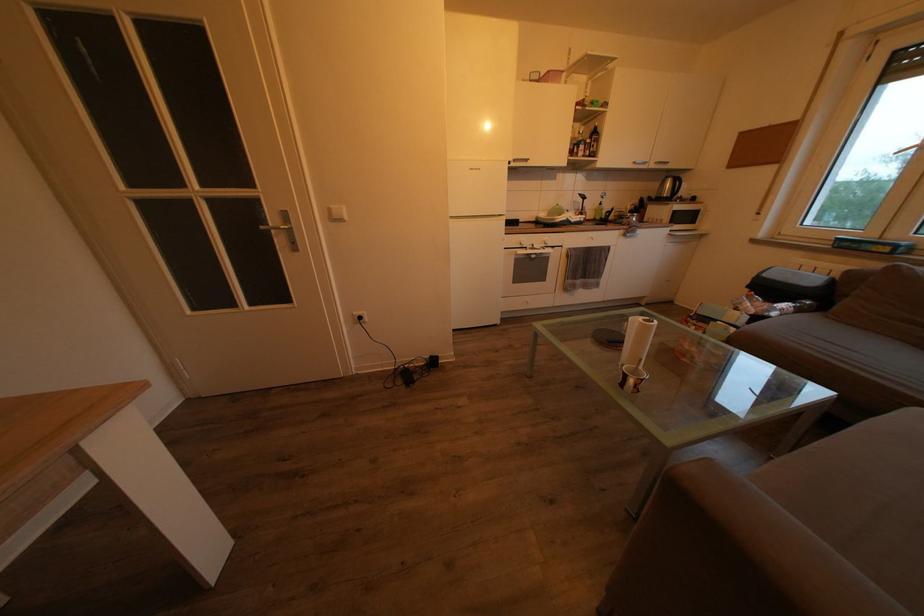
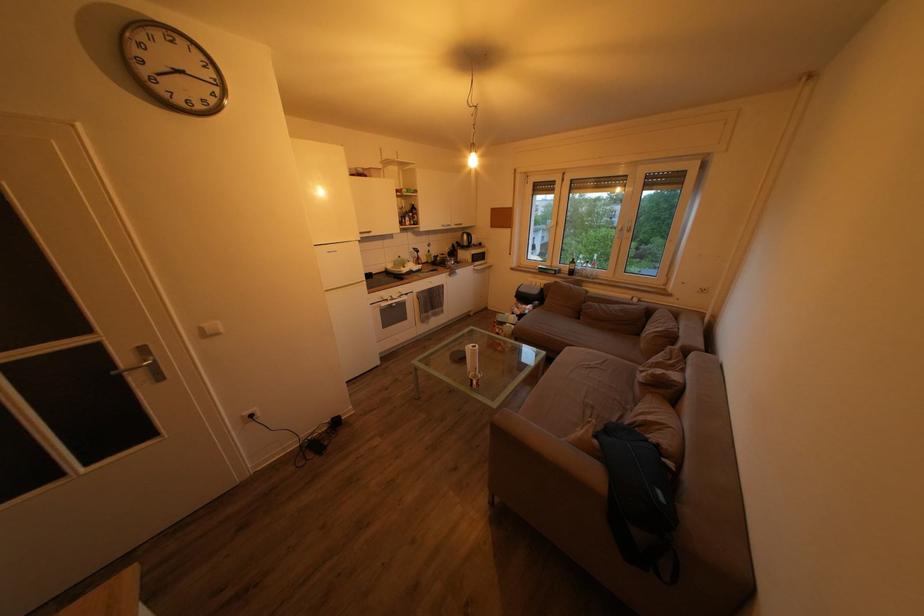
Where in the second image is the point corresponding to point 339,213 from the first image?

(211, 331)